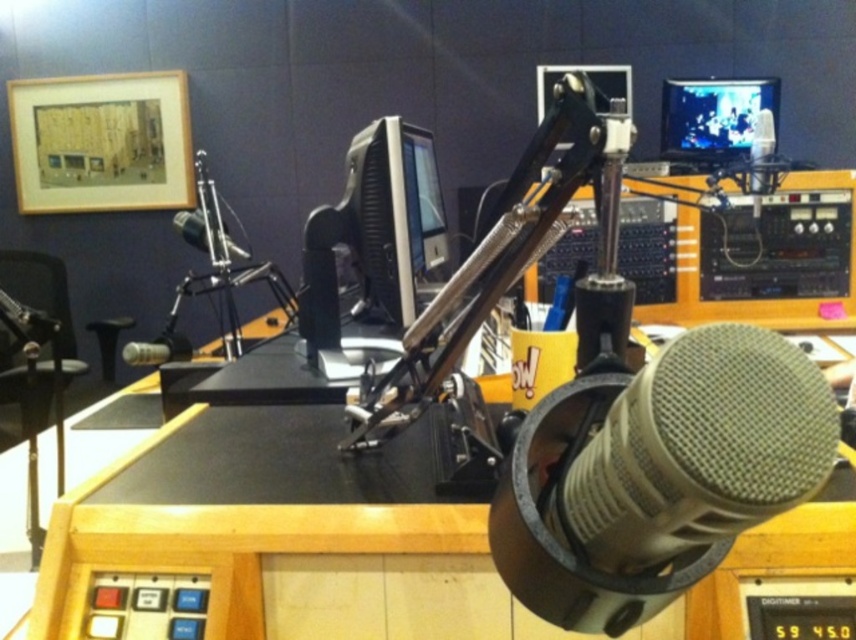
Question: From the image, what is the correct spatial relationship of matte black monitor at upper right in relation to metallic silver microphone at center?

Choices:
 (A) left
 (B) right

Answer: (B)

Question: Which point is closer to the camera taking this photo?

Choices:
 (A) (158, 352)
 (B) (771, 92)
 (C) (173, 225)
 (D) (765, 156)

Answer: (A)

Question: Which object appears closest to the camera in this image?

Choices:
 (A) satin silver microphone at upper right
 (B) satin black microphone at center
 (C) matte black monitor at upper right

Answer: (A)

Question: Does satin silver microphone at upper right have a smaller size compared to satin black microphone at center?

Choices:
 (A) yes
 (B) no

Answer: (B)

Question: Is matte black monitor at upper right bigger than metallic silver microphone at center?

Choices:
 (A) no
 (B) yes

Answer: (B)

Question: Which object appears farthest from the camera in this image?

Choices:
 (A) matte black monitor at upper right
 (B) satin silver microphone at upper right
 (C) matte gray microphone at center
 (D) satin black microphone at center

Answer: (A)